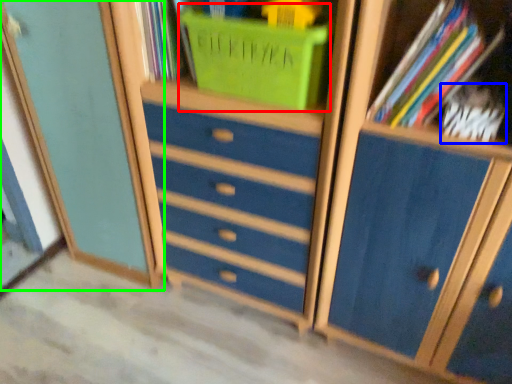
Question: Based on their relative distances, which object is farther from basket (highlighted by a red box)? Choose from book (highlighted by a blue box) and cupboard (highlighted by a green box).

Choices:
 (A) book
 (B) cupboard

Answer: (B)